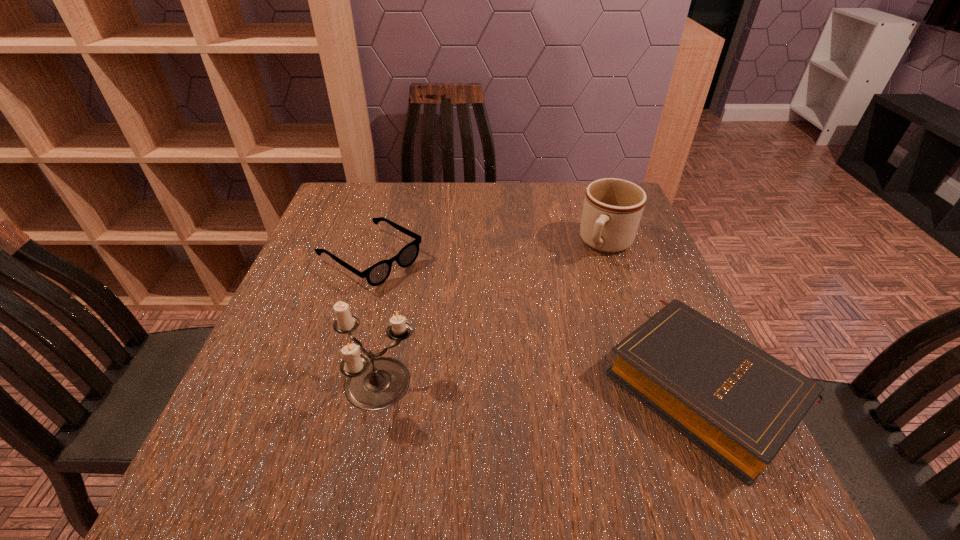
Where is `the tallest object`? The width and height of the screenshot is (960, 540). the tallest object is located at coordinates (374, 383).

Identify the location of Bible. This screenshot has width=960, height=540. (739, 404).

You are a GUI agent. You are given a task and a screenshot of the screen. Output one action in this format:
    pyautogui.click(x=<x>, y=<y>)
    Task: Click on the spectacles
    
    Given the screenshot: What is the action you would take?
    pyautogui.click(x=377, y=274)

Locate an element on the screen. This screenshot has height=540, width=960. mug is located at coordinates (612, 209).

Locate an element on the screen. This screenshot has height=540, width=960. free location located 0.140m on the back of the candle holder is located at coordinates (396, 307).

You are a GUI agent. You are given a task and a screenshot of the screen. Output one action in this format:
    pyautogui.click(x=<x>, y=<y>)
    Task: Click on the free space located 0.380m on the left of the Bible
    Image resolution: width=960 pixels, height=540 pixels.
    Given the screenshot: What is the action you would take?
    pyautogui.click(x=404, y=384)

You are a GUI agent. You are given a task and a screenshot of the screen. Output one action in this format:
    pyautogui.click(x=<x>, y=<y>)
    Task: Click on the free location located 0.070m on the arms of the spectacles
    This screenshot has height=540, width=960.
    Given the screenshot: What is the action you would take?
    pyautogui.click(x=427, y=294)

What are the coordinates of `blank space located 0.250m on the arms of the spectacles` in the screenshot? It's located at (488, 333).

Identify the location of free space located 0.190m on the arms of the spectacles. (467, 319).

Where is `free location located on the side of the mug with the handle`? This screenshot has width=960, height=540. free location located on the side of the mug with the handle is located at coordinates (573, 300).